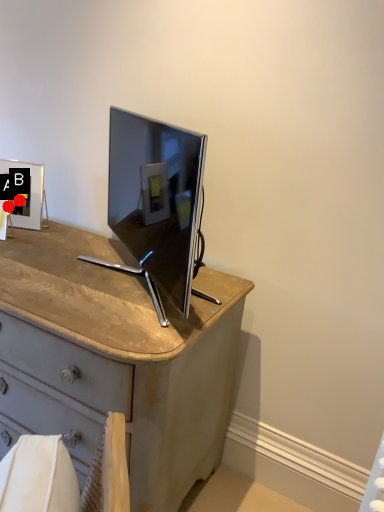
Question: Two points are circled on the image, labeled by A and B beside each circle. Which point is farther to the camera?

Choices:
 (A) A is further
 (B) B is further

Answer: (B)